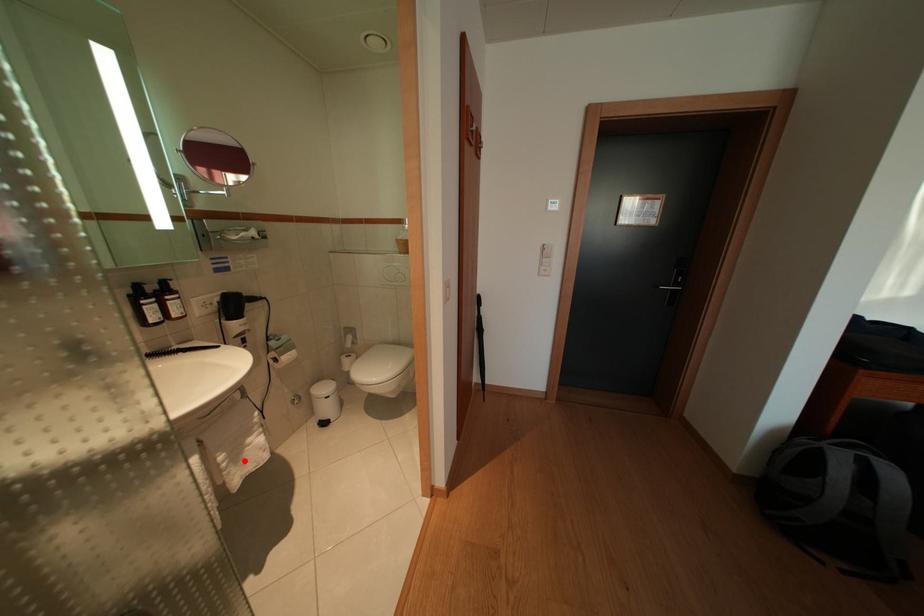
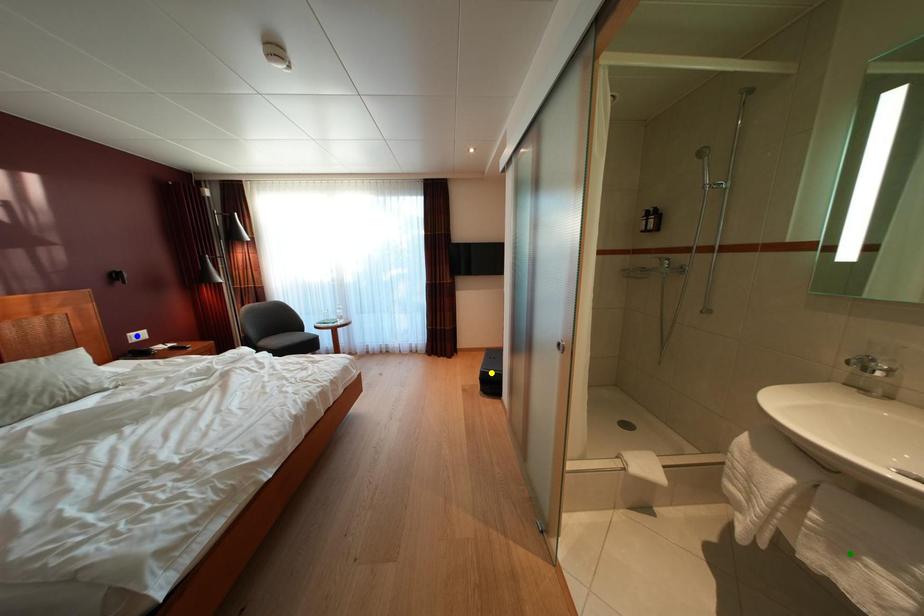
Question: I am providing you with two images of the same scene from different viewpoints. A red point is marked on the first image. You are given multiple points on the second image. In image 2, which mark is for the same physical point as the one in image 1?

Choices:
 (A) yellow point
 (B) blue point
 (C) green point

Answer: (C)